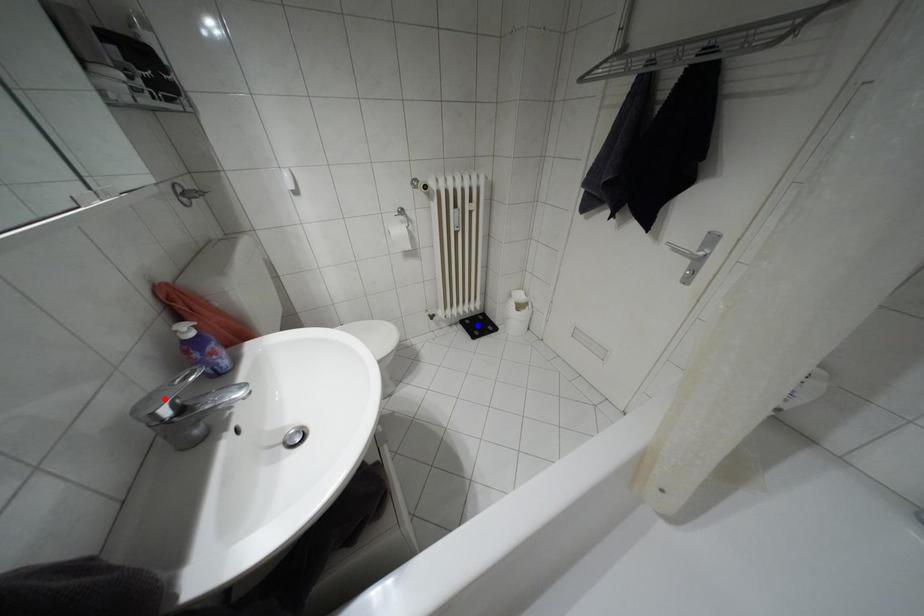
Question: In the image, two points are highlighted. Which point is nearer to the camera? Reply with the corresponding letter.

Choices:
 (A) blue point
 (B) red point

Answer: (B)